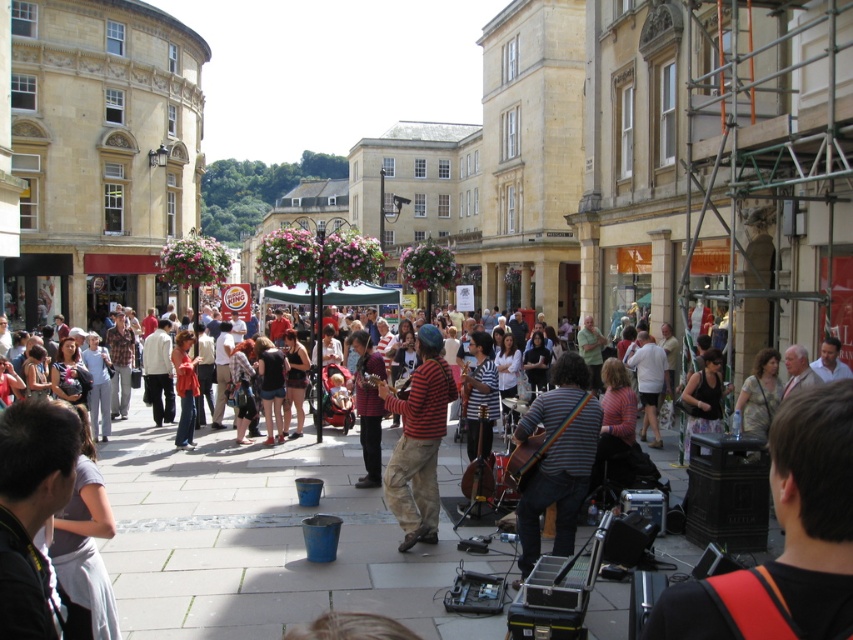
Is point (585, 435) closer to viewer compared to point (422, 355)?

Yes, point (585, 435) is in front of point (422, 355).

Does point (556, 497) come farther from viewer compared to point (418, 496)?

That is False.

What are the coordinates of `striped fabric guitar at center` in the screenshot? It's located at (558, 486).